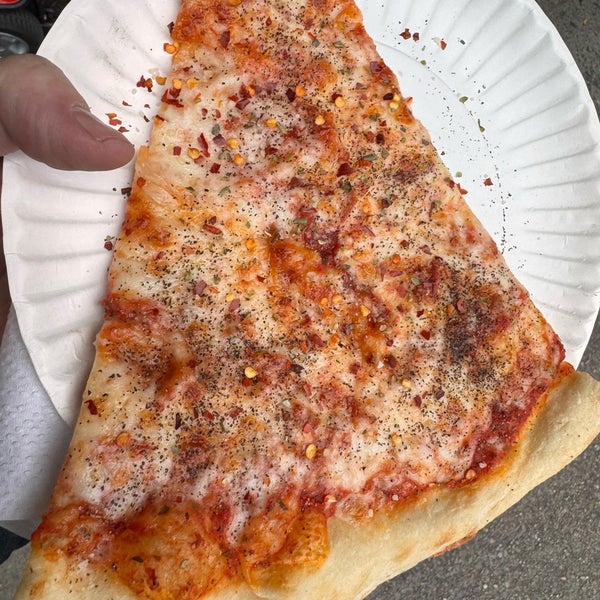
What are the coordinates of `paper towel` in the screenshot? It's located at (16, 437).